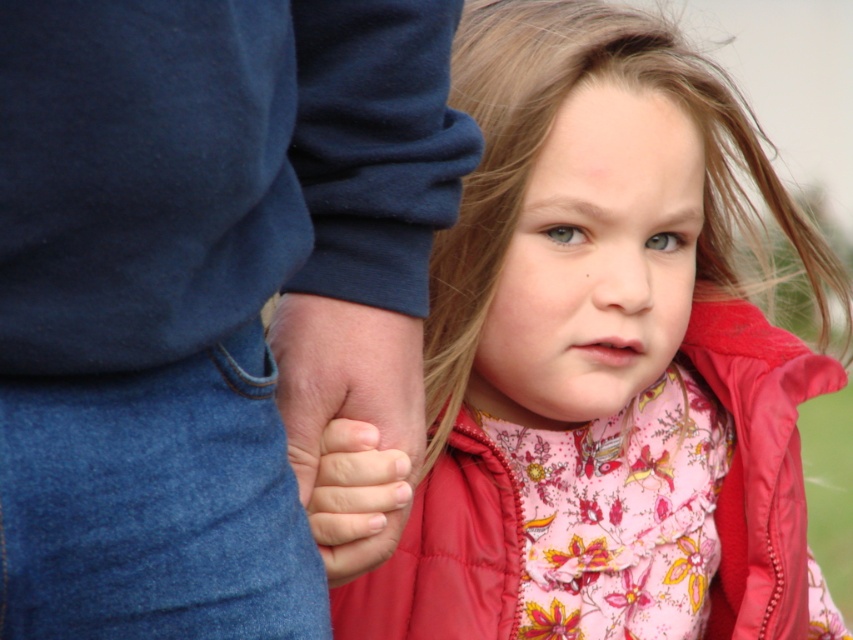
Question: Does floral fabric dress at center come behind smooth skin hand at center?

Choices:
 (A) no
 (B) yes

Answer: (B)

Question: Is floral fabric dress at center to the left of smooth skin hand at center from the viewer's perspective?

Choices:
 (A) yes
 (B) no

Answer: (B)

Question: Is floral fabric dress at center wider than smooth skin hand at center?

Choices:
 (A) yes
 (B) no

Answer: (A)

Question: Which object appears closest to the camera in this image?

Choices:
 (A) smooth skin hand at center
 (B) floral fabric dress at center

Answer: (A)